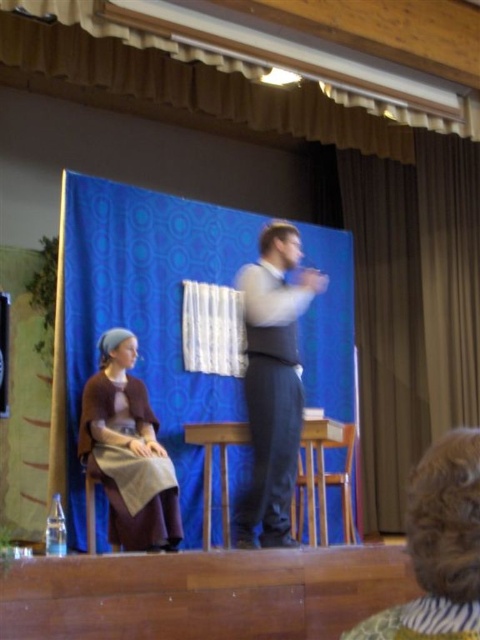
You are an event planner arranging a photoshoot in the auditorium. You need to position a spotlight so that it illuminates both the curly brown hair at lower right and the matte brown dress at left without casting shadows on the backdrop. Considering their positions, which object should be placed higher to ensure proper lighting?

The curly brown hair at lower right is above the matte brown dress at left, so positioning the spotlight to focus on the curly brown hair at lower right first will ensure both are illuminated without casting shadows on the backdrop.